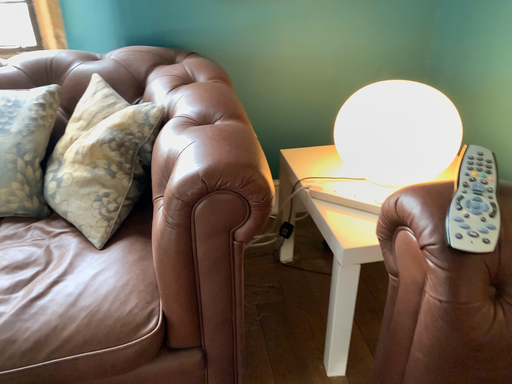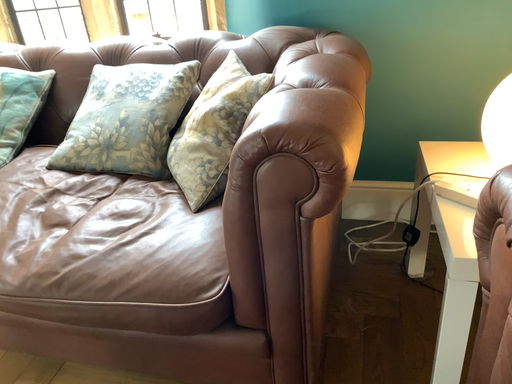
Question: Which way did the camera rotate in the video?

Choices:
 (A) rotated right
 (B) rotated left

Answer: (B)